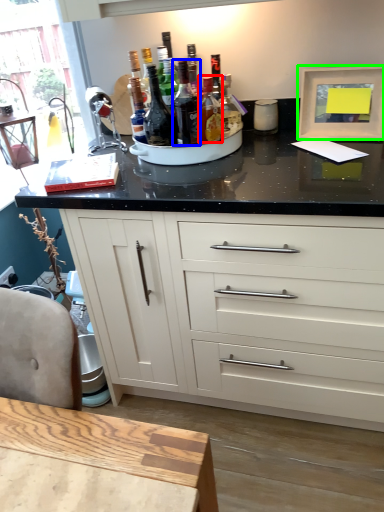
Question: Based on their relative distances, which object is nearer to bottle (highlighted by a red box)? Choose from bottle (highlighted by a blue box) and picture frame (highlighted by a green box).

Choices:
 (A) bottle
 (B) picture frame

Answer: (A)